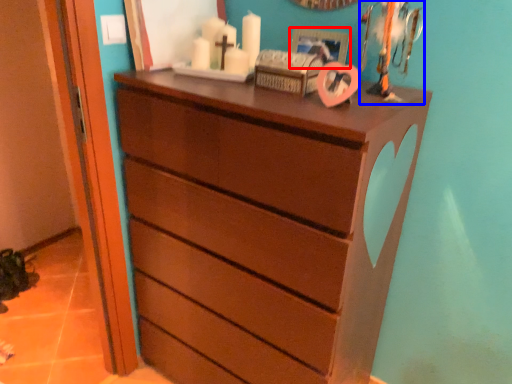
Question: Which of the following is the closest to the observer, picture frame (highlighted by a red box) or toy (highlighted by a blue box)?

Choices:
 (A) picture frame
 (B) toy

Answer: (B)